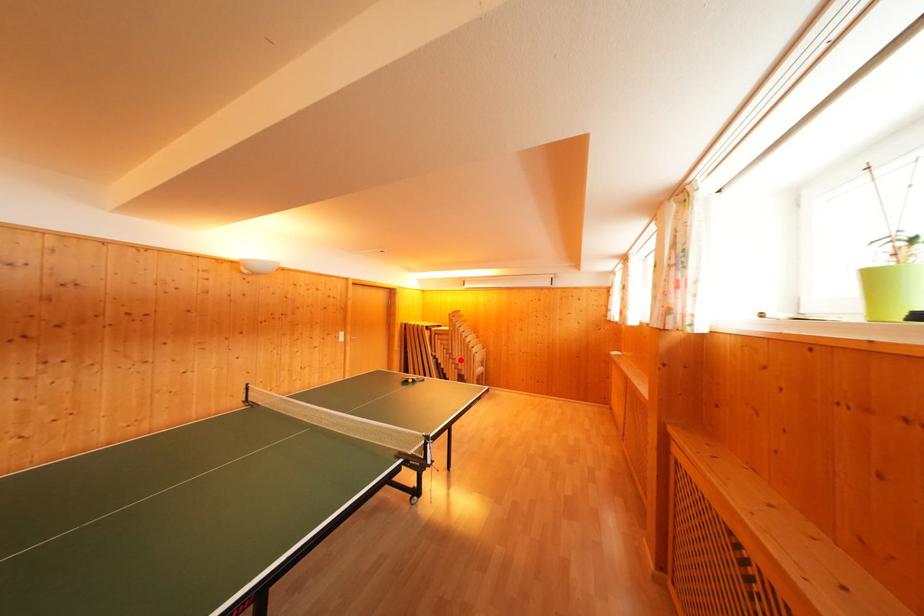
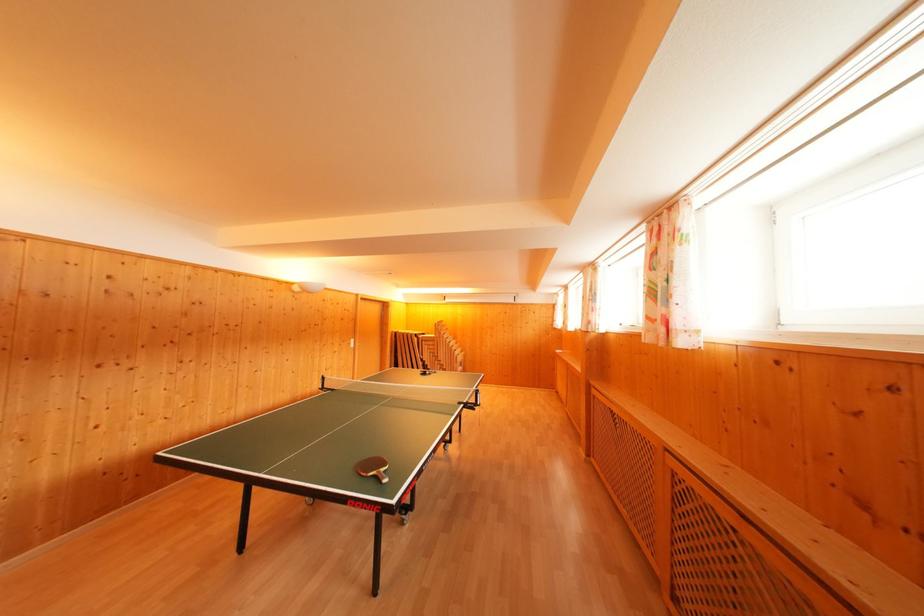
Where in the second image is the point corresponding to the highlighted location from the first image?

(445, 362)